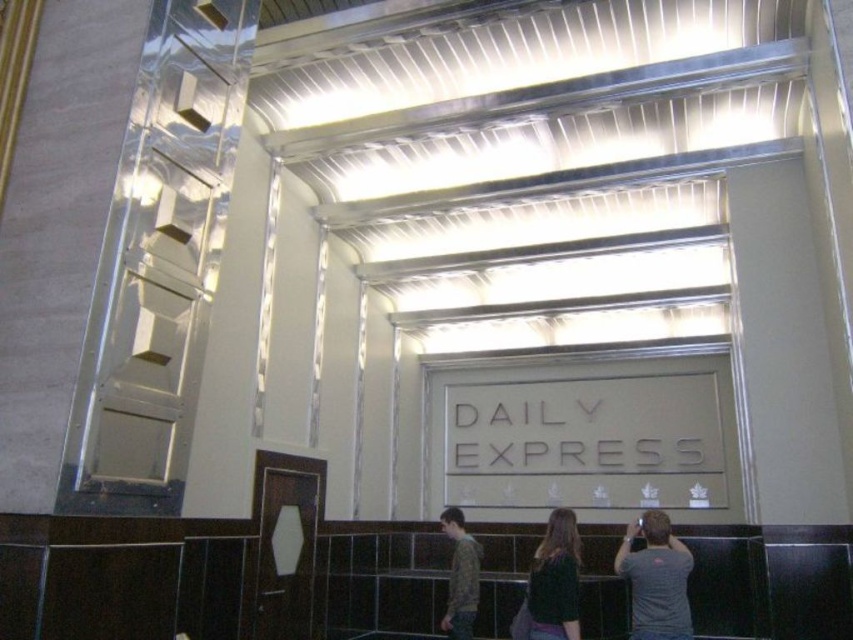
Question: Considering the real-world distances, which object is farthest from the dark brown leather jacket at center?

Choices:
 (A) camouflage-patterned shirt at lower center
 (B) gray t-shirt at center

Answer: (A)

Question: Among these points, which one is farthest from the camera?

Choices:
 (A) (573, 540)
 (B) (657, 637)
 (C) (477, 570)

Answer: (C)

Question: Is the position of gray t-shirt at center less distant than that of dark brown leather jacket at center?

Choices:
 (A) no
 (B) yes

Answer: (A)

Question: Does dark brown leather jacket at center have a smaller size compared to camouflage-patterned shirt at lower center?

Choices:
 (A) yes
 (B) no

Answer: (A)

Question: Which point is farther to the camera?

Choices:
 (A) camouflage-patterned shirt at lower center
 (B) gray t-shirt at center
 (C) dark brown leather jacket at center

Answer: (A)

Question: Is dark brown leather jacket at center below camouflage-patterned shirt at lower center?

Choices:
 (A) no
 (B) yes

Answer: (A)